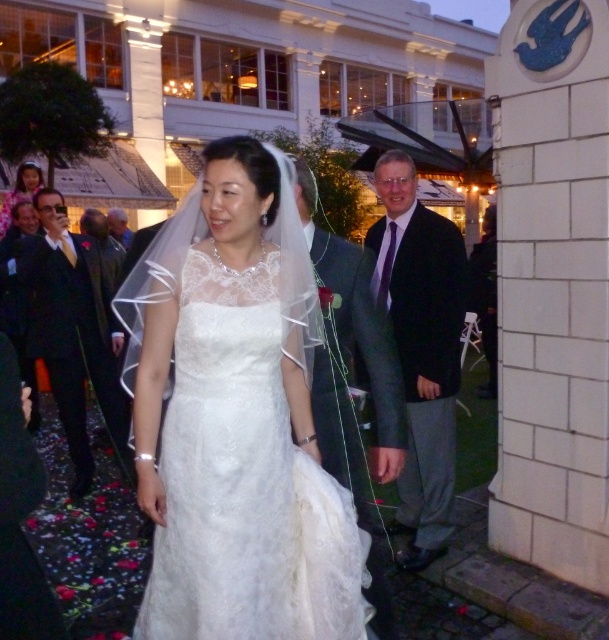
Does lace fabric dress at center have a smaller size compared to shiny black suit at left?

Indeed, lace fabric dress at center has a smaller size compared to shiny black suit at left.

Between lace fabric dress at center and shiny black suit at left, which one has more height?

Standing taller between the two is shiny black suit at left.

Is point (219, 611) less distant than point (51, 230)?

Yes.

This screenshot has height=640, width=609. I want to click on lace fabric dress at center, so click(x=236, y=417).

Who is higher up, lace fabric dress at center or matte white dress at upper left?

Positioned higher is matte white dress at upper left.

Between lace fabric dress at center and matte white dress at upper left, which one is positioned lower?

lace fabric dress at center is below.

Image resolution: width=609 pixels, height=640 pixels. Describe the element at coordinates (236, 417) in the screenshot. I see `lace fabric dress at center` at that location.

Identify the location of lace fabric dress at center. (236, 417).

Does lace fabric dress at center have a larger size compared to gray wool suit at center?

Actually, lace fabric dress at center might be smaller than gray wool suit at center.

Is point (213, 268) farther from viewer compared to point (381, 625)?

No, (213, 268) is in front of (381, 625).

Where is `lace fabric dress at center`? This screenshot has width=609, height=640. lace fabric dress at center is located at coordinates (236, 417).

The height and width of the screenshot is (640, 609). Identify the location of lace fabric dress at center. (236, 417).